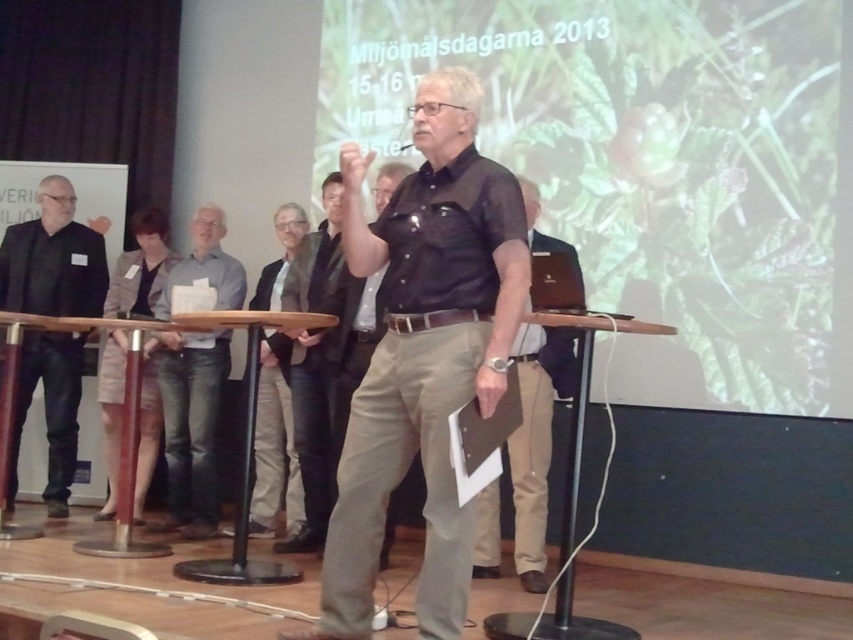
Question: Which point is closer to the camera?

Choices:
 (A) (172, 380)
 (B) (57, 256)
 (C) (109, 384)

Answer: (A)

Question: Which of these objects is positioned farthest from the jeans at center?

Choices:
 (A) black leather jacket at left
 (B) green leafy plant at upper center
 (C) patterned fabric skirt at center

Answer: (B)

Question: Which point is farther to the camera?

Choices:
 (A) dark gray shirt at center
 (B) dark brown leather shirt at center

Answer: (A)

Question: From the image, what is the correct spatial relationship of green leafy plant at upper center in relation to black leather jacket at left?

Choices:
 (A) left
 (B) right

Answer: (B)

Question: Does black leather jacket at left have a larger size compared to jeans at center?

Choices:
 (A) no
 (B) yes

Answer: (B)

Question: Is patterned fabric skirt at center smaller than dark gray shirt at center?

Choices:
 (A) yes
 (B) no

Answer: (A)